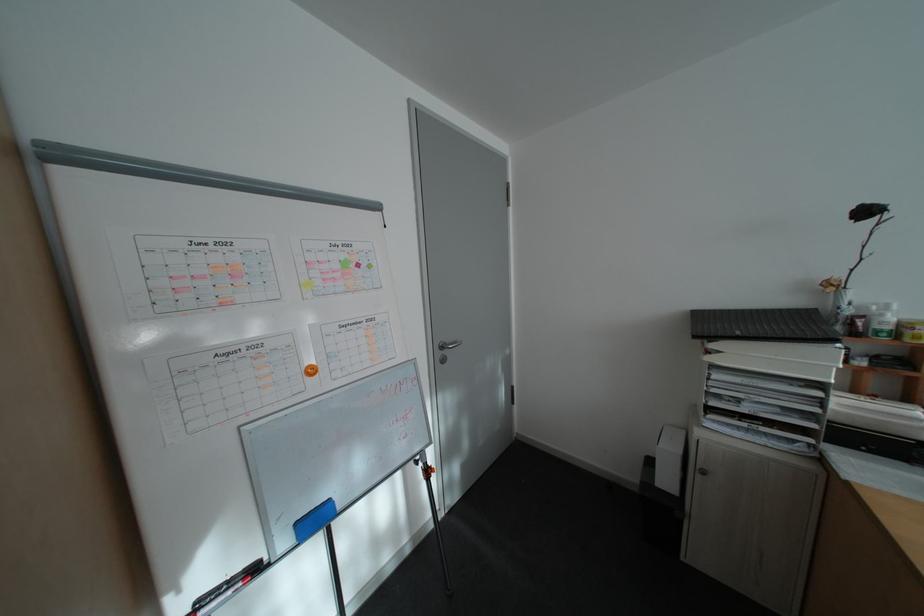
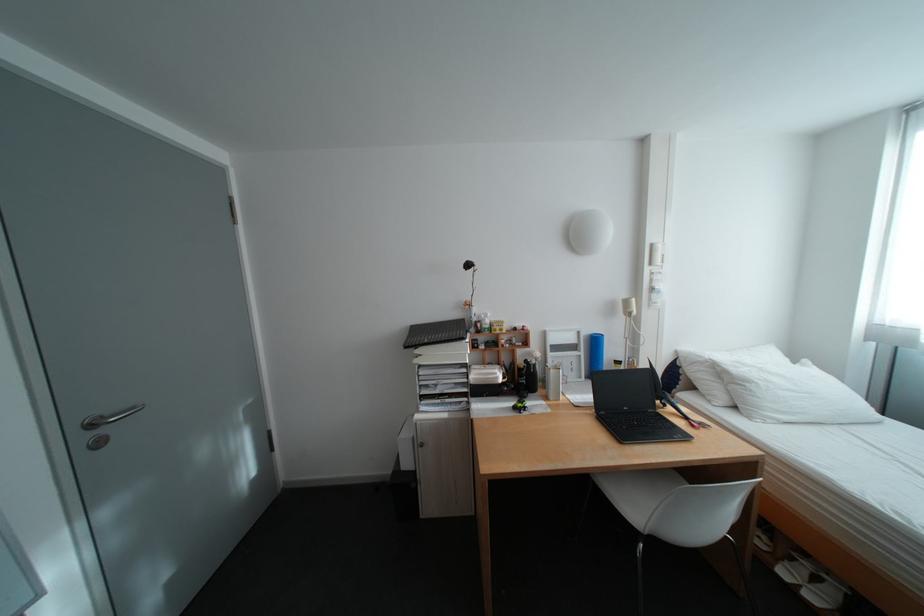
Locate, in the second image, the point that corresponds to the point at 457,344 in the first image.

(115, 418)